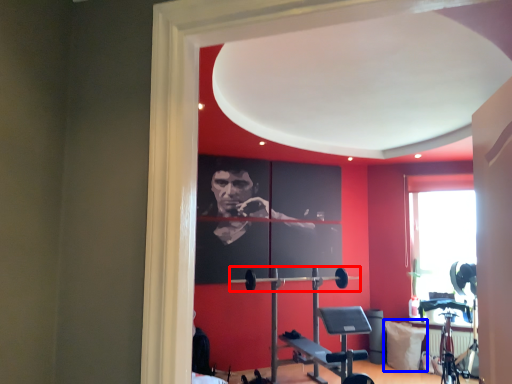
Question: Which object appears farthest to the camera in this image, barbell (highlighted by a red box) or pillow (highlighted by a blue box)?

Choices:
 (A) barbell
 (B) pillow

Answer: (B)